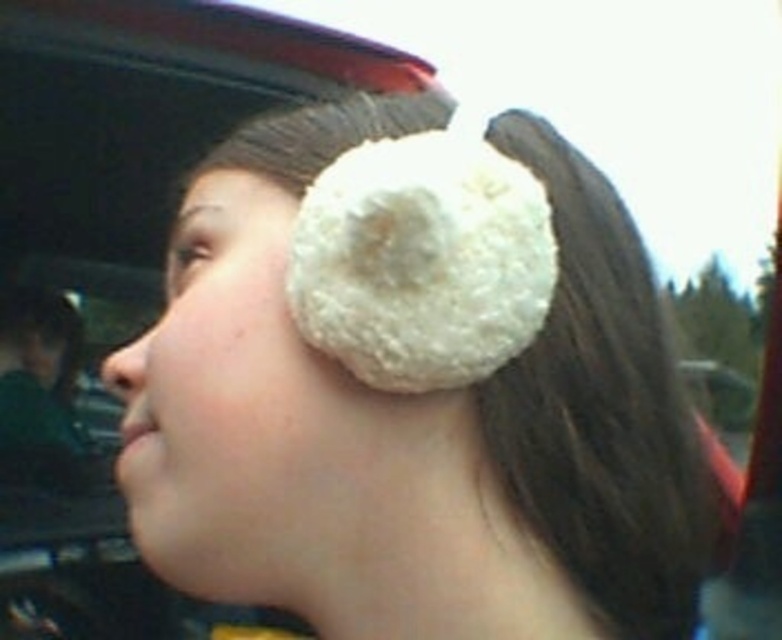
Question: Which point is closer to the camera?

Choices:
 (A) (189, 448)
 (B) (594, 426)

Answer: (A)

Question: Does white fluffy earmuffs at upper right have a lesser width compared to white fluffy ear muffs at upper right?

Choices:
 (A) yes
 (B) no

Answer: (B)

Question: Does white fluffy earmuffs at upper right have a smaller size compared to white fluffy ear muffs at upper right?

Choices:
 (A) yes
 (B) no

Answer: (B)

Question: Can you confirm if white fluffy earmuffs at upper right is positioned to the right of white fluffy ear muffs at upper right?

Choices:
 (A) yes
 (B) no

Answer: (A)